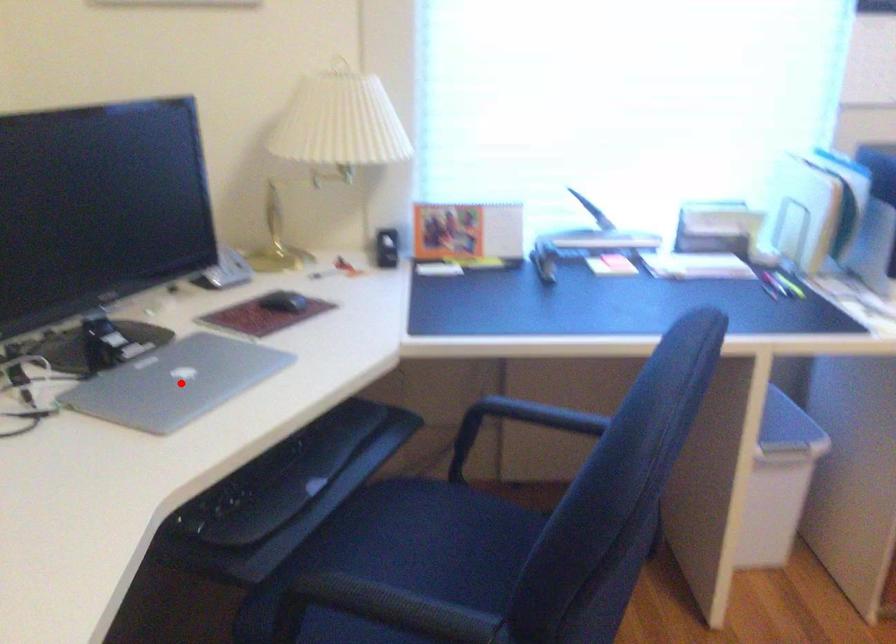
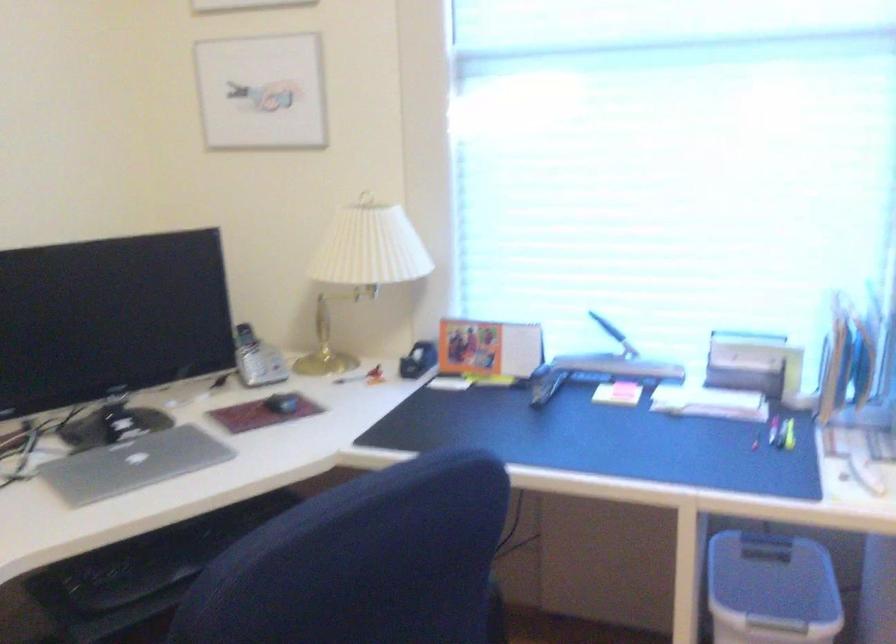
Question: A red point is marked in image1. In image2, is the corresponding 3D point closer to the camera or farther? Reply with the corresponding letter.

Choices:
 (A) The corresponding 3D point is closer.
 (B) The corresponding 3D point is farther.

Answer: (B)